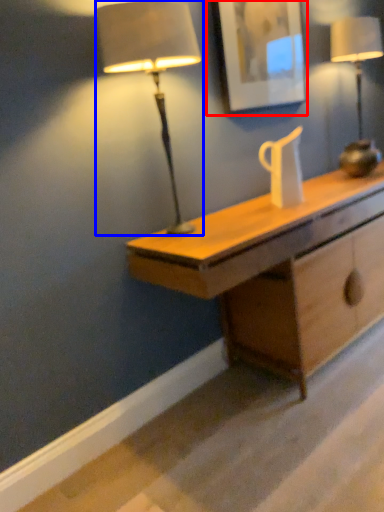
Question: Which of the following is the closest to the observer, picture frame (highlighted by a red box) or lamp (highlighted by a blue box)?

Choices:
 (A) picture frame
 (B) lamp

Answer: (B)